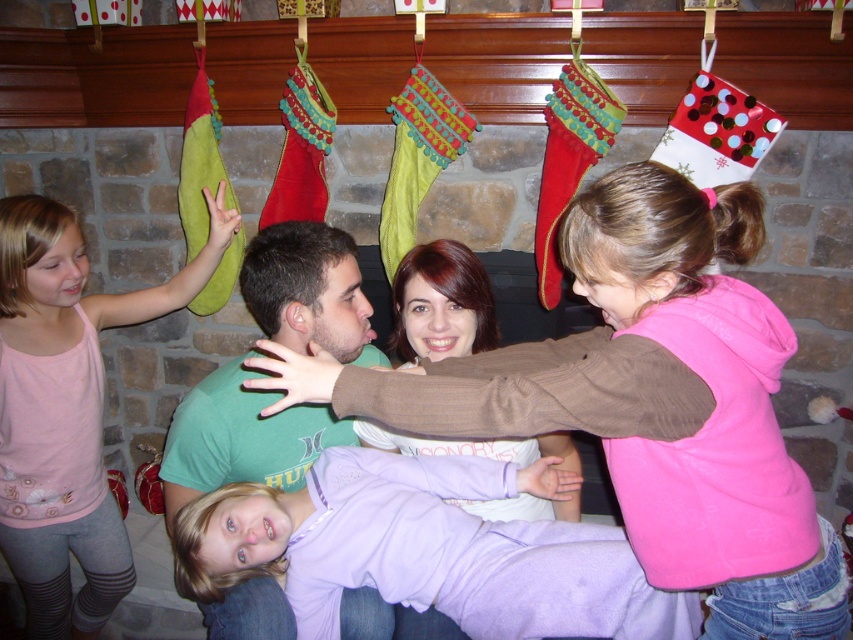
You are standing in front of the fireplace scene. There are two points marked in the image. The first point is at coordinate point (798, 512) and the second point is at coordinate point (1, 355). Which point is closer to you?

Point (798, 512) is closer to the viewer than point (1, 355).

You are a photographer taking a picture of the family scene. You notice the pink fleece hoodie at upper right and the pink fabric dress at left. Which one is positioned higher in the image?

The pink fleece hoodie at upper right is positioned higher in the image than the pink fabric dress at left.